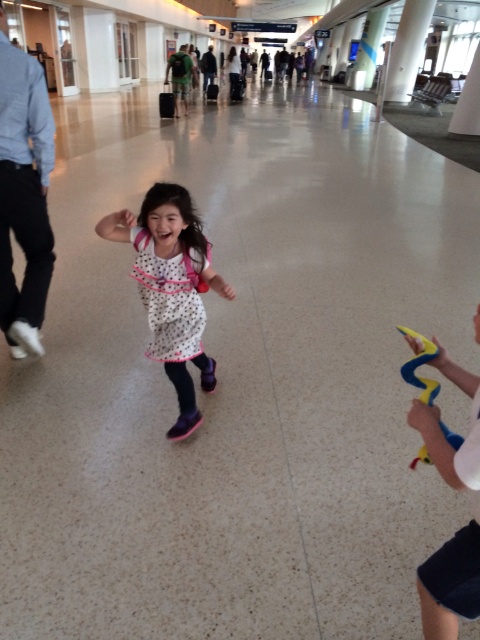
Does point (36, 282) come in front of point (410, 467)?

No, (36, 282) is behind (410, 467).

Who is positioned more to the left, light blue shirt at left or yellow rubber snake at right?

From the viewer's perspective, light blue shirt at left appears more on the left side.

Is point (0, 109) more distant than point (418, 456)?

Yes, point (0, 109) is farther from viewer.

The width and height of the screenshot is (480, 640). In order to click on light blue shirt at left in this screenshot , I will do `click(24, 195)`.

The width and height of the screenshot is (480, 640). What do you see at coordinates (419, 365) in the screenshot?
I see `yellow rubber snake at right` at bounding box center [419, 365].

Who is taller, yellow rubber snake at right or green fabric backpack at upper center?

green fabric backpack at upper center is taller.

Where is `yellow rubber snake at right`? The height and width of the screenshot is (640, 480). yellow rubber snake at right is located at coordinates (419, 365).

You are a GUI agent. You are given a task and a screenshot of the screen. Output one action in this format:
    pyautogui.click(x=<x>, y=<y>)
    Task: Click on the yellow rubber snake at right
    Image resolution: width=480 pixels, height=640 pixels.
    Given the screenshot: What is the action you would take?
    pyautogui.click(x=419, y=365)

Is yellow rubber snake at right to the left of dark blue jeans at center from the viewer's perspective?

Incorrect, yellow rubber snake at right is not on the left side of dark blue jeans at center.

The height and width of the screenshot is (640, 480). What do you see at coordinates (419, 365) in the screenshot?
I see `yellow rubber snake at right` at bounding box center [419, 365].

Is point (458, 435) positioned before point (201, 64)?

Yes, point (458, 435) is closer to viewer.

Where is `yellow rubber snake at right`? The width and height of the screenshot is (480, 640). yellow rubber snake at right is located at coordinates (419, 365).